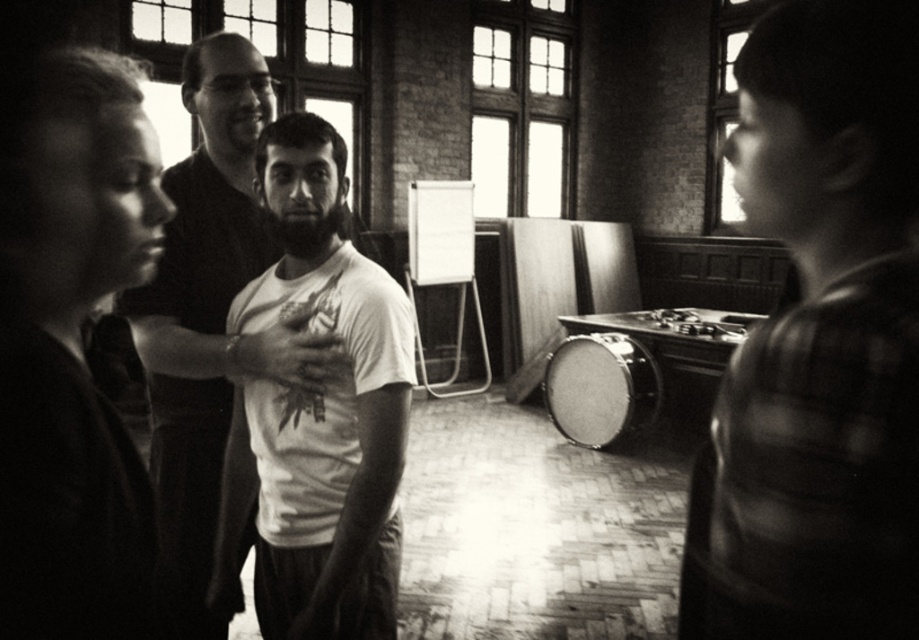
Question: Does plaid shirt at right come in front of smooth drum at center?

Choices:
 (A) no
 (B) yes

Answer: (B)

Question: Is white matte t-shirt at center bigger than smooth white t-shirt at center?

Choices:
 (A) no
 (B) yes

Answer: (A)

Question: Which point is closer to the camera?

Choices:
 (A) (161, 440)
 (B) (373, 289)

Answer: (B)

Question: Which object is the farthest from the white matte t-shirt at center?

Choices:
 (A) plaid shirt at right
 (B) smooth white t-shirt at center

Answer: (A)

Question: Estimate the real-world distances between objects in this image. Which object is closer to the plaid shirt at right?

Choices:
 (A) smooth white t-shirt at center
 (B) smooth drum at center

Answer: (A)

Question: Is plaid shirt at right below smooth white t-shirt at center?

Choices:
 (A) no
 (B) yes

Answer: (B)